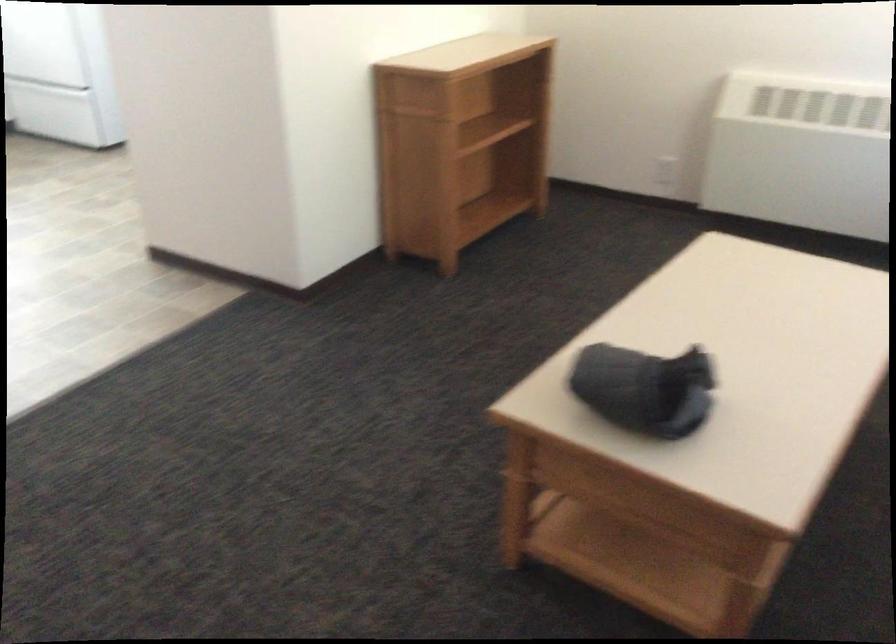
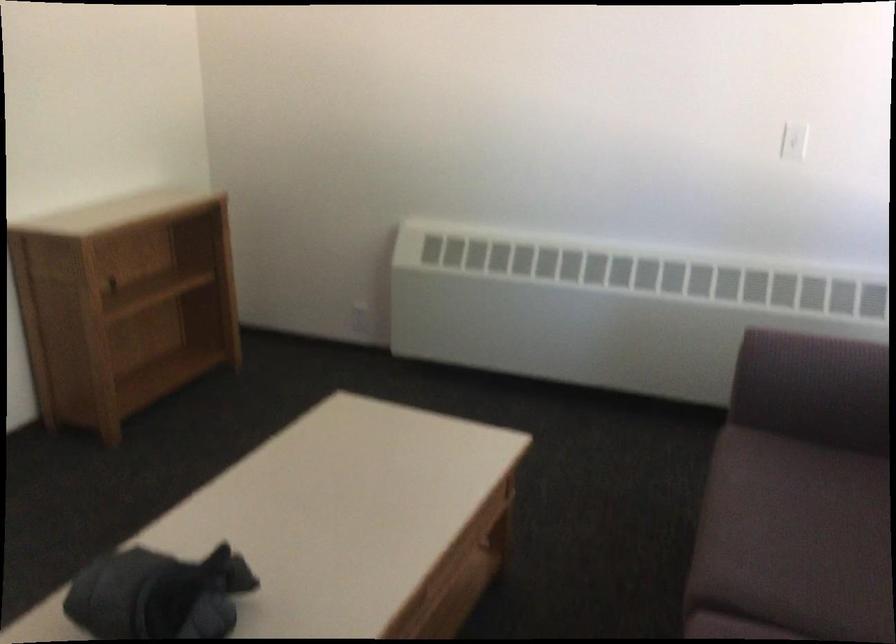
Question: How did the camera likely rotate?

Choices:
 (A) Left
 (B) Right
 (C) Up
 (D) Down

Answer: (B)